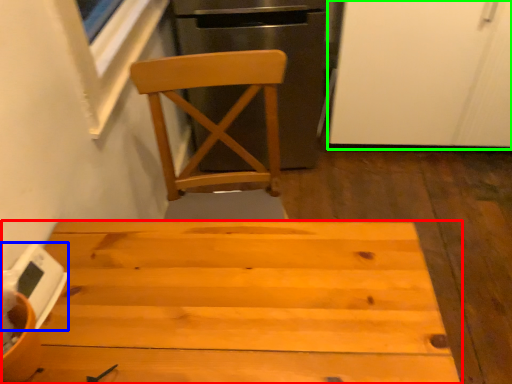
Question: Estimate the real-world distances between objects in this image. Which object is closer to table (highlighted by a red box), appliance (highlighted by a blue box) or screen door (highlighted by a green box)?

Choices:
 (A) appliance
 (B) screen door

Answer: (A)